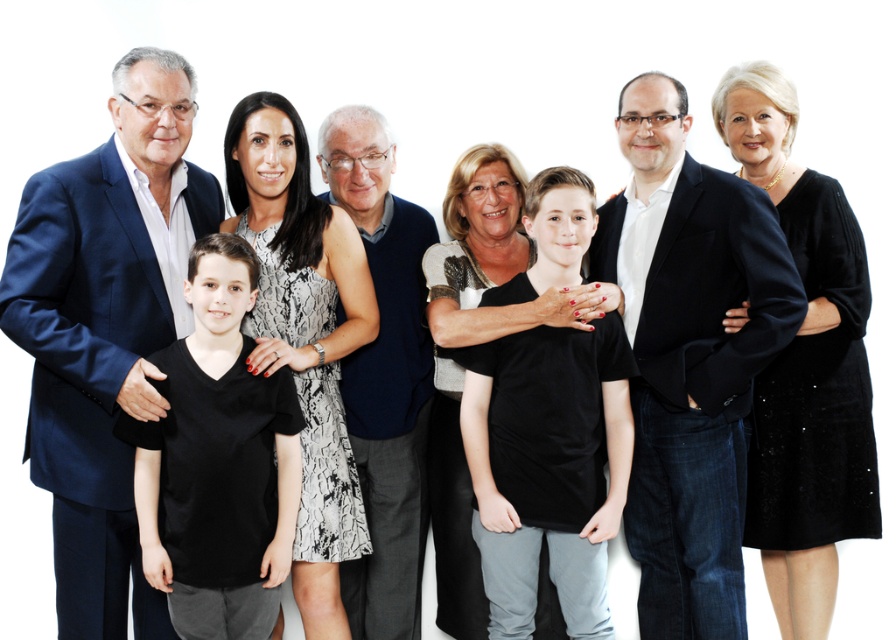
You are a photographer trying to adjust the lighting for a group photo. You notice two distinct clothing items in the middle row of the group. The navy blue suit at left and the dark blue sweater at center. Which clothing item requires more space due to its size?

The navy blue suit at left requires more space due to its larger size compared to the dark blue sweater at center.